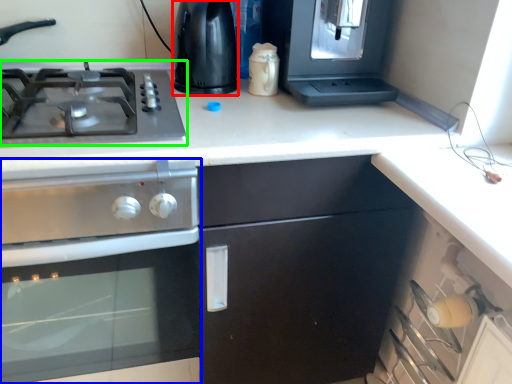
Question: Based on their relative distances, which object is nearer to appliance (highlighted by a red box)? Choose from kitchen appliance (highlighted by a blue box) and gas stove (highlighted by a green box).

Choices:
 (A) kitchen appliance
 (B) gas stove

Answer: (B)